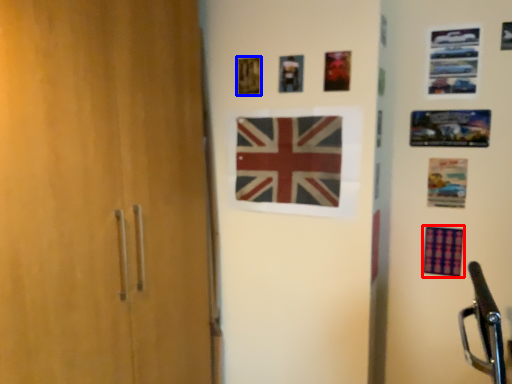
Question: Which object appears farthest to the camera in this image, flag (highlighted by a red box) or picture frame (highlighted by a blue box)?

Choices:
 (A) flag
 (B) picture frame

Answer: (A)